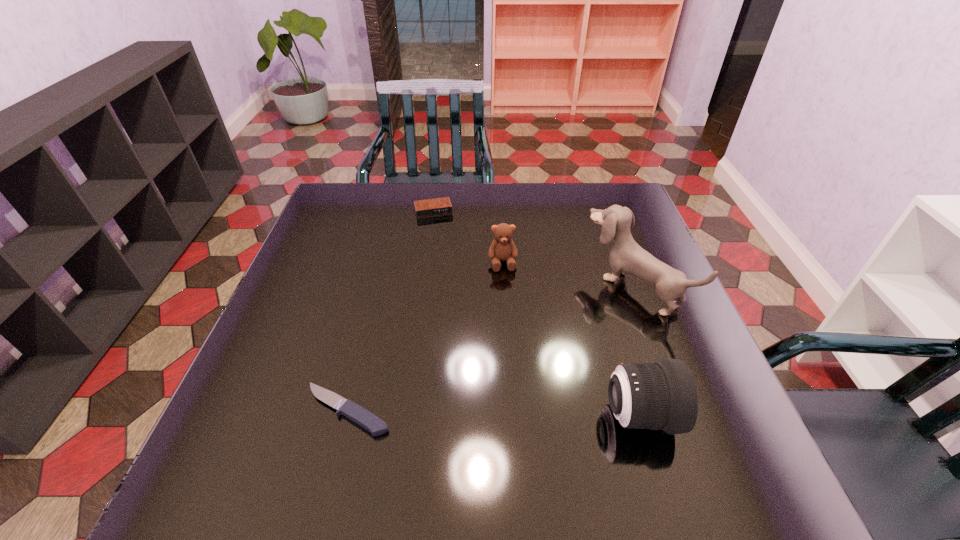
The width and height of the screenshot is (960, 540). What are the coordinates of `vacant space positioned on the face of the third tallest object` in the screenshot? It's located at (511, 327).

I want to click on vacant space located on the face of the third tallest object, so click(515, 355).

At what (x,y) coordinates should I click in order to perform the action: click on vacant space located at the face of the tallest object. Please return your answer as a coordinate pair (x, y). Looking at the image, I should click on (587, 325).

Image resolution: width=960 pixels, height=540 pixels. In order to click on free region located at the face of the tallest object in this screenshot , I will do `click(584, 327)`.

The height and width of the screenshot is (540, 960). Identify the location of blank area located at the face of the tallest object. (578, 331).

Find the location of a particular element. free space located 0.320m on the front face of the farthest object is located at coordinates (456, 289).

Where is `free space located 0.340m on the front face of the farthest object`? Image resolution: width=960 pixels, height=540 pixels. free space located 0.340m on the front face of the farthest object is located at coordinates (458, 295).

I want to click on vacant space located 0.060m on the front face of the farthest object, so click(440, 230).

Where is `object located in the far edge section of the desktop`? The height and width of the screenshot is (540, 960). object located in the far edge section of the desktop is located at coordinates (438, 206).

Identify the location of steak knife present at the near edge. This screenshot has height=540, width=960. point(356,413).